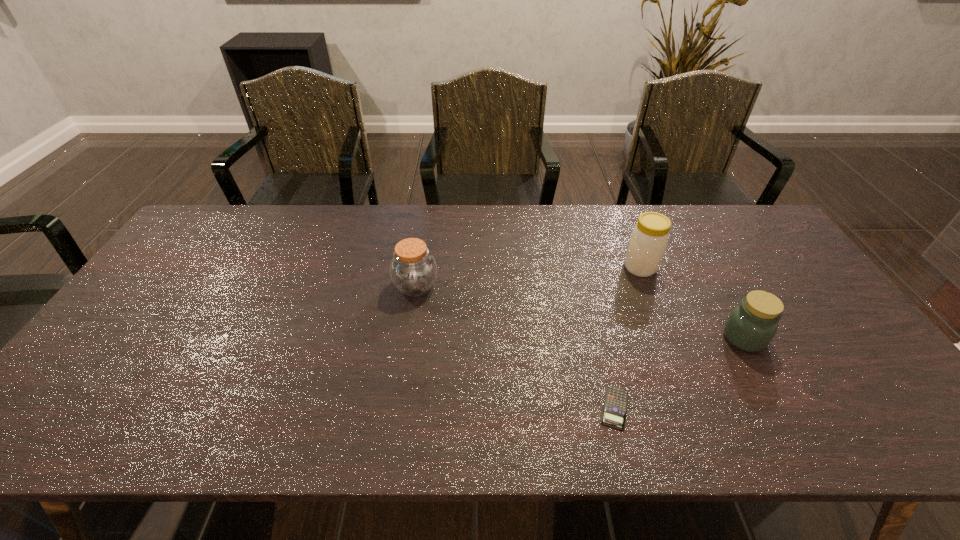
Where is `blank space located on the left of the shortest object`? This screenshot has width=960, height=540. blank space located on the left of the shortest object is located at coordinates click(456, 408).

Locate an element on the screen. Image resolution: width=960 pixels, height=540 pixels. object present at the near edge is located at coordinates (615, 406).

This screenshot has height=540, width=960. What are the coordinates of `vacant region at the far edge of the desktop` in the screenshot? It's located at (517, 241).

Identify the location of vacant region at the near edge. This screenshot has height=540, width=960. (788, 416).

Locate an element on the screen. This screenshot has height=540, width=960. vacant space at the left edge of the desktop is located at coordinates (130, 322).

Image resolution: width=960 pixels, height=540 pixels. What are the coordinates of `vacant space at the right edge` in the screenshot? It's located at (878, 379).

The image size is (960, 540). In the image, there is a desktop. Find the location of `free region at the far left corner`. free region at the far left corner is located at coordinates click(x=205, y=225).

The height and width of the screenshot is (540, 960). In the image, there is a desktop. In order to click on vacant region at the far right corner in this screenshot , I will do `click(738, 224)`.

Where is `vacant area that lies between the second jar from left to right and the leftmost object`? This screenshot has width=960, height=540. vacant area that lies between the second jar from left to right and the leftmost object is located at coordinates (528, 277).

Locate an element on the screen. This screenshot has width=960, height=540. empty location between the calculator and the leftmost jar is located at coordinates coord(516,347).